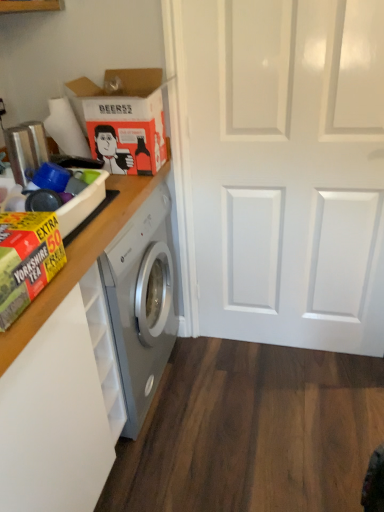
Question: Is orange matte cardboard box at upper left, the first cardboard box when ordered from back to front, looking in the opposite direction of yellow-green cardboard box at left, the 1th cardboard box when ordered from bottom to top?

Choices:
 (A) no
 (B) yes

Answer: (A)

Question: Considering the relative sizes of orange matte cardboard box at upper left, the first cardboard box when ordered from back to front, and yellow-green cardboard box at left, the second cardboard box when ordered from back to front, in the image provided, is orange matte cardboard box at upper left, the first cardboard box when ordered from back to front, shorter than yellow-green cardboard box at left, the second cardboard box when ordered from back to front,?

Choices:
 (A) yes
 (B) no

Answer: (B)

Question: Does orange matte cardboard box at upper left, marked as the first cardboard box in a top-to-bottom arrangement, appear on the left side of yellow-green cardboard box at left, which is the first cardboard box from front to back?

Choices:
 (A) no
 (B) yes

Answer: (A)

Question: Does orange matte cardboard box at upper left, the 2th cardboard box in the front-to-back sequence, appear on the right side of yellow-green cardboard box at left, the 1th cardboard box when ordered from bottom to top?

Choices:
 (A) yes
 (B) no

Answer: (A)

Question: Considering the relative sizes of orange matte cardboard box at upper left, the 2th cardboard box in the front-to-back sequence, and yellow-green cardboard box at left, marked as the second cardboard box in a top-to-bottom arrangement, in the image provided, is orange matte cardboard box at upper left, the 2th cardboard box in the front-to-back sequence, bigger than yellow-green cardboard box at left, marked as the second cardboard box in a top-to-bottom arrangement,?

Choices:
 (A) yes
 (B) no

Answer: (A)

Question: Considering the relative sizes of orange matte cardboard box at upper left, arranged as the 2th cardboard box when ordered from the bottom, and yellow-green cardboard box at left, marked as the second cardboard box in a top-to-bottom arrangement, in the image provided, is orange matte cardboard box at upper left, arranged as the 2th cardboard box when ordered from the bottom, taller than yellow-green cardboard box at left, marked as the second cardboard box in a top-to-bottom arrangement,?

Choices:
 (A) no
 (B) yes

Answer: (B)

Question: Can you confirm if yellow cardboard box at left is smaller than yellow-green cardboard box at left, the second cardboard box when ordered from back to front?

Choices:
 (A) yes
 (B) no

Answer: (B)

Question: Is yellow cardboard box at left taller than yellow-green cardboard box at left, marked as the second cardboard box in a top-to-bottom arrangement?

Choices:
 (A) yes
 (B) no

Answer: (B)

Question: Considering the relative sizes of yellow cardboard box at left and yellow-green cardboard box at left, the second cardboard box when ordered from back to front, in the image provided, is yellow cardboard box at left wider than yellow-green cardboard box at left, the second cardboard box when ordered from back to front,?

Choices:
 (A) no
 (B) yes

Answer: (B)

Question: From a real-world perspective, is yellow cardboard box at left beneath yellow-green cardboard box at left, the 1th cardboard box when ordered from bottom to top?

Choices:
 (A) no
 (B) yes

Answer: (B)

Question: Is yellow cardboard box at left not close to yellow-green cardboard box at left, marked as the second cardboard box in a top-to-bottom arrangement?

Choices:
 (A) yes
 (B) no

Answer: (B)

Question: Can you confirm if yellow cardboard box at left is positioned to the left of yellow-green cardboard box at left, the second cardboard box when ordered from back to front?

Choices:
 (A) no
 (B) yes

Answer: (B)

Question: From the image's perspective, is orange matte cardboard box at upper left, the first cardboard box when ordered from back to front, below white glossy door at center?

Choices:
 (A) no
 (B) yes

Answer: (A)